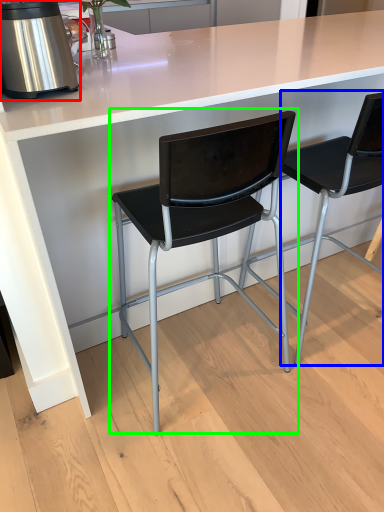
Question: Which object is positioned closest to kitchen appliance (highlighted by a red box)? Select from chair (highlighted by a blue box) and chair (highlighted by a green box).

Choices:
 (A) chair
 (B) chair

Answer: (B)